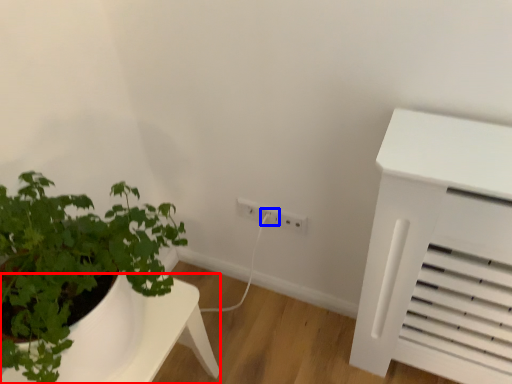
Question: Which point is further to the camera, table (highlighted by a red box) or electric outlet (highlighted by a blue box)?

Choices:
 (A) table
 (B) electric outlet

Answer: (B)